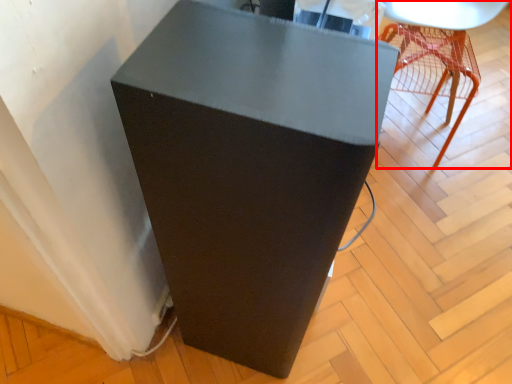
Question: From the image, what is the correct spatial relationship of furniture (annotated by the red box) in relation to furniture?

Choices:
 (A) right
 (B) left

Answer: (A)